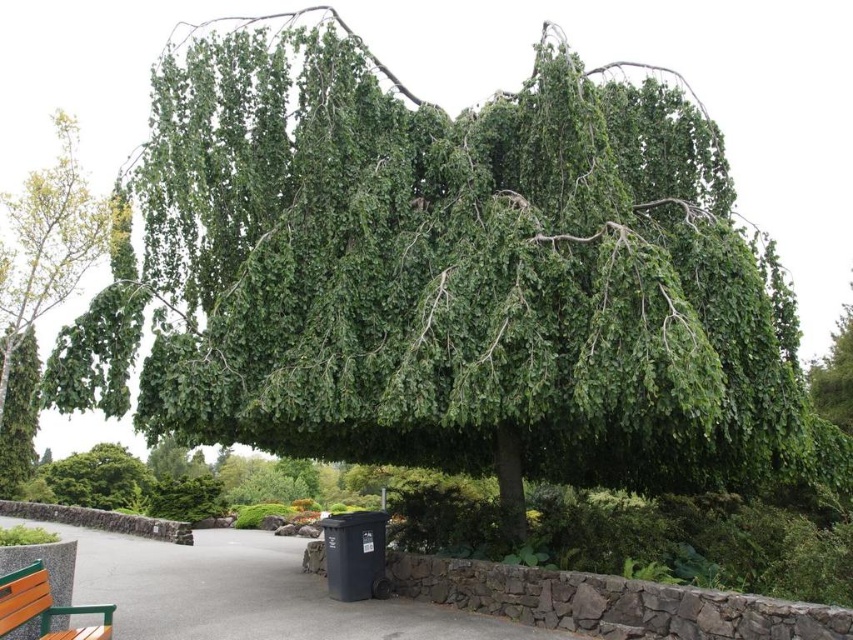
Is point (45, 241) closer to viewer compared to point (32, 608)?

No.

You are a GUI agent. You are given a task and a screenshot of the screen. Output one action in this format:
    pyautogui.click(x=<x>, y=<y>)
    Task: Click on the green leafy tree at left
    The height and width of the screenshot is (640, 853).
    Given the screenshot: What is the action you would take?
    pyautogui.click(x=39, y=284)

The height and width of the screenshot is (640, 853). In order to click on green leafy tree at left in this screenshot , I will do `click(39, 284)`.

Is point (3, 573) more distant than point (103, 230)?

No, (3, 573) is closer to viewer.

The width and height of the screenshot is (853, 640). Describe the element at coordinates (248, 593) in the screenshot. I see `gray asphalt path at center` at that location.

Who is more distant from viewer, (207, 621) or (27, 182)?

Positioned behind is point (27, 182).

Where is `gray asphalt path at center`? The width and height of the screenshot is (853, 640). gray asphalt path at center is located at coordinates [248, 593].

Is gray asphalt path at center above wooden bench at lower left?

No.

Who is shorter, gray asphalt path at center or wooden bench at lower left?

wooden bench at lower left is shorter.

This screenshot has width=853, height=640. Identify the location of gray asphalt path at center. (248, 593).